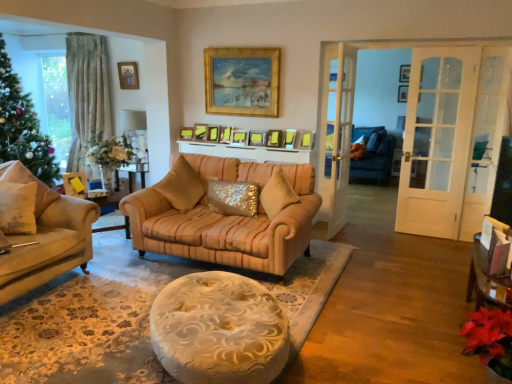
Question: In terms of height, does wooden picture frame at upper left, the 3th picture frame positioned from the back, look taller or shorter compared to green matte christmas tree at left?

Choices:
 (A) short
 (B) tall

Answer: (A)

Question: Looking at their shapes, would you say wooden picture frame at upper left, the 1th picture frame in the left-to-right sequence, is wider or thinner than green matte christmas tree at left?

Choices:
 (A) wide
 (B) thin

Answer: (B)

Question: Which object is positioned closest to the matte yellow picture frame at center, which ranks as the third picture frame in left-to-right order?

Choices:
 (A) matte gold picture frame at center, positioned as the eighth picture frame in right-to-left order
 (B) shiny gold pillow at center, the fifth pillow viewed from the left
 (C) matte wooden picture frame at center, the 2th picture frame when ordered from front to back
 (D) sparkly gold pillow at center, the second pillow positioned from the right
 (E) beige fabric pillow at left, the 5th pillow positioned from the right

Answer: (A)

Question: Considering the real-world distances, which object is closest to the gold-framed painting at upper center, which appears as the seventh picture frame when viewed from the left?

Choices:
 (A) matte gold picture frame at center, the 4th picture frame positioned from the left
 (B) wooden picture frame at upper center, the first picture frame positioned from the right
 (C) matte white lampshade at upper left
 (D) matte gold picture frame at center, positioned as the eighth picture frame in right-to-left order
 (E) gold textured pillow at left, the second pillow from the left

Answer: (D)